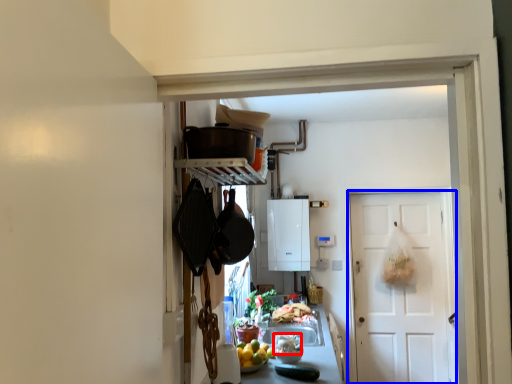
Question: Among these objects, which one is nearest to the camera, food (highlighted by a red box) or door (highlighted by a blue box)?

Choices:
 (A) food
 (B) door

Answer: (A)